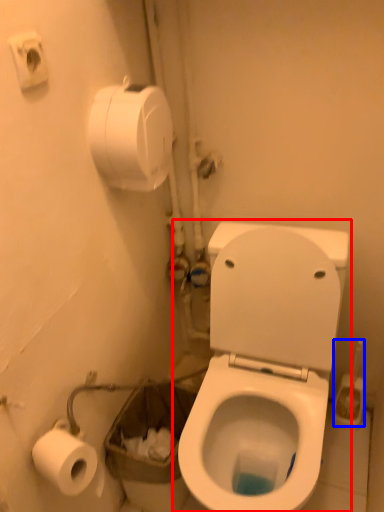
Question: Which point is closer to the camera, toilet (highlighted by a red box) or brush (highlighted by a blue box)?

Choices:
 (A) toilet
 (B) brush

Answer: (A)